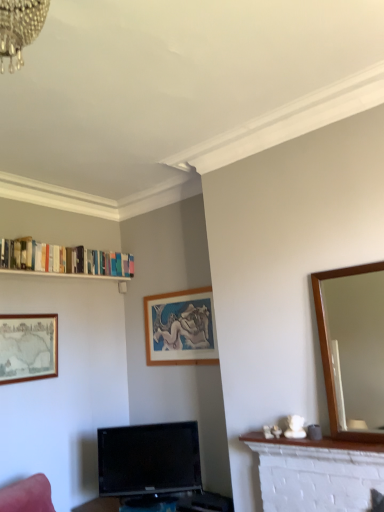
Question: Looking at the image, does white glossy bookshelf at upper left seem bigger or smaller compared to wooden mirror at right?

Choices:
 (A) small
 (B) big

Answer: (A)

Question: In terms of height, does white glossy bookshelf at upper left look taller or shorter compared to wooden mirror at right?

Choices:
 (A) tall
 (B) short

Answer: (B)

Question: Estimate the real-world distances between objects in this image. Which object is farther from the wooden mirror at right?

Choices:
 (A) wooden picture frame at center, marked as the 1th picture frame in a right-to-left arrangement
 (B) gold-framed map at left, the 2th picture frame when ordered from right to left
 (C) white glossy bookshelf at upper left
 (D) white brick fireplace at lower right
 (E) black glossy tv at lower center

Answer: (C)

Question: Considering the real-world distances, which object is closest to the white brick fireplace at lower right?

Choices:
 (A) black glossy tv at lower center
 (B) wooden mirror at right
 (C) white glossy bookshelf at upper left
 (D) gold-framed map at left, the 2th picture frame when ordered from right to left
 (E) wooden picture frame at center, which is counted as the second picture frame, starting from the left

Answer: (B)